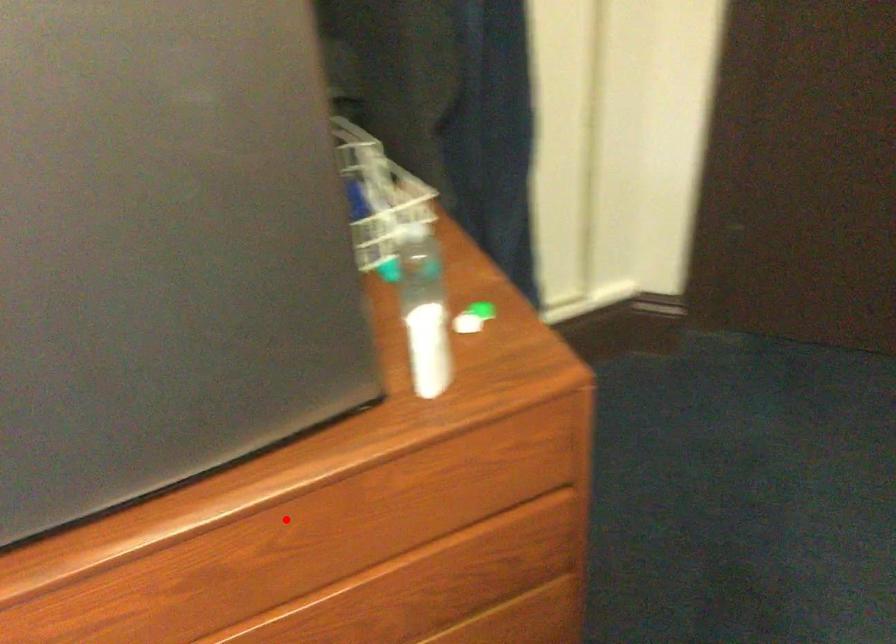
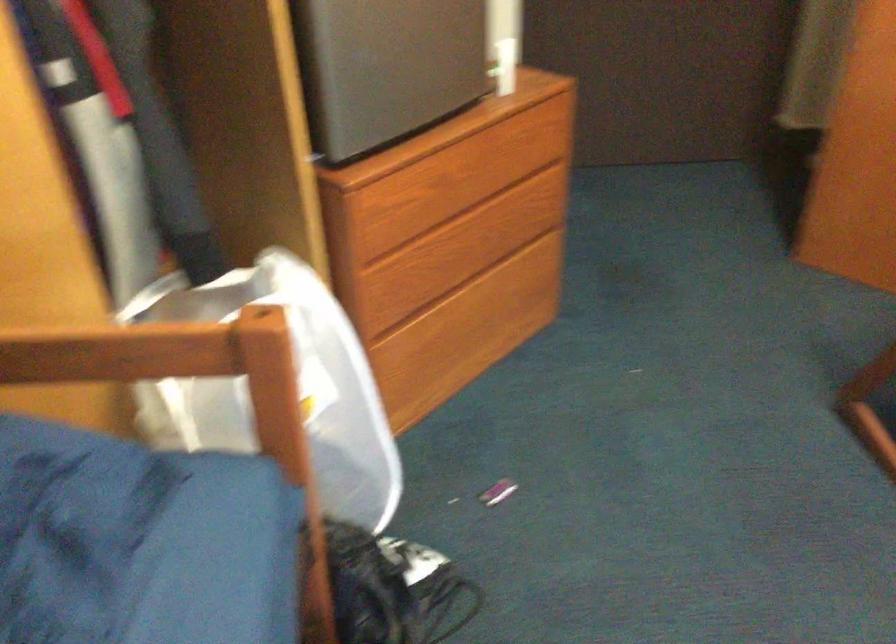
The point at the highlighted location is marked in the first image. Where is the corresponding point in the second image?

(462, 152)